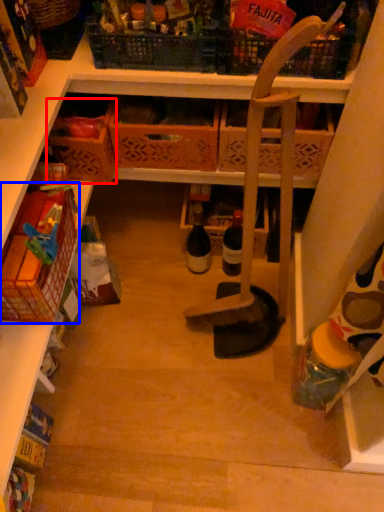
Question: Among these objects, which one is nearest to the camera, basket (highlighted by a red box) or basket (highlighted by a blue box)?

Choices:
 (A) basket
 (B) basket

Answer: (B)